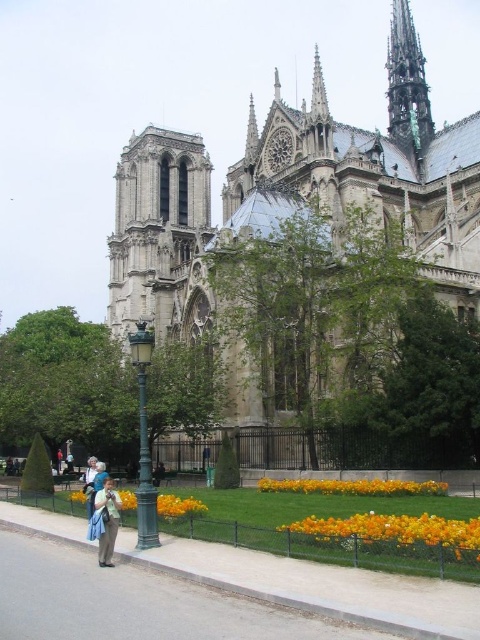
Question: Which point is farther to the camera?

Choices:
 (A) (268, 593)
 (B) (423, 58)
 (C) (97, 506)

Answer: (B)

Question: Observing the image, what is the correct spatial positioning of smooth concrete pavement at lower left in reference to yellow fabric flower at lower center?

Choices:
 (A) left
 (B) right

Answer: (B)

Question: Which object is farther from the camera taking this photo?

Choices:
 (A) yellow matte flower bed at center
 (B) green copper spire at upper right
 (C) stone gothic cathedral at center
 (D) smooth concrete pavement at lower left

Answer: (B)

Question: Is stone gothic cathedral at center positioned behind light brown leather jacket at lower left?

Choices:
 (A) no
 (B) yes

Answer: (B)

Question: Can you confirm if stone gothic cathedral at center is positioned above vibrant orange petals at lower right?

Choices:
 (A) yes
 (B) no

Answer: (A)

Question: Which point appears closest to the camera in this image?

Choices:
 (A) (402, 88)
 (B) (457, 605)
 (C) (104, 563)

Answer: (B)